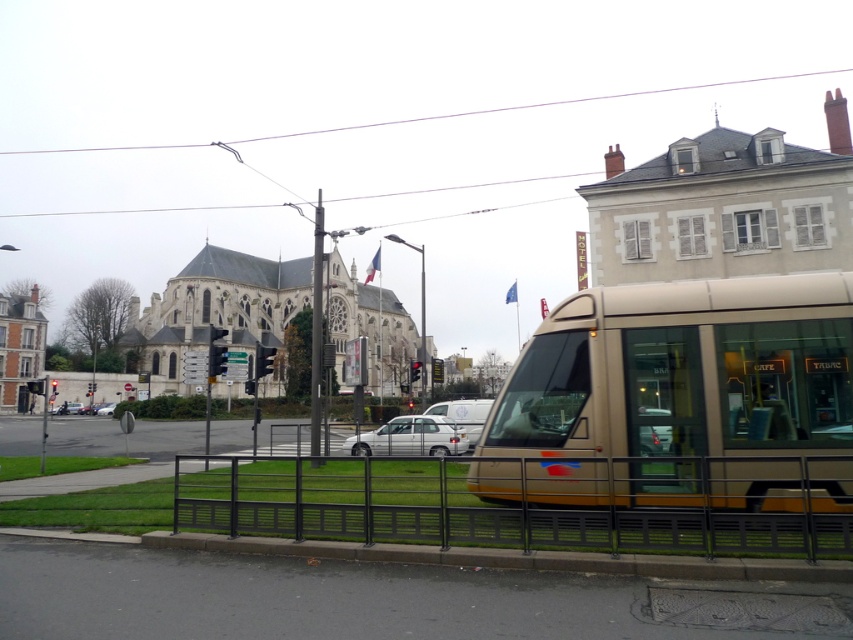
Question: Where is gold metallic tram at center located in relation to metallic gray fence at lower center in the image?

Choices:
 (A) left
 (B) right

Answer: (B)

Question: Can you confirm if white matte car at center is positioned below silver metallic sedan at center?

Choices:
 (A) no
 (B) yes

Answer: (A)

Question: Which of the following is the closest to the observer?

Choices:
 (A) (608, 304)
 (B) (405, 438)
 (C) (100, 413)
 (D) (225, 461)

Answer: (A)

Question: Can you confirm if metallic gray fence at lower center is wider than silver metallic sedan at center?

Choices:
 (A) no
 (B) yes

Answer: (B)

Question: Estimate the real-world distances between objects in this image. Which object is farther from the silver metallic sedan at center?

Choices:
 (A) white matte car at center
 (B) metallic gray fence at lower center
 (C) gold metallic tram at center

Answer: (C)

Question: Which object is farther from the camera taking this photo?

Choices:
 (A) gold metallic tram at center
 (B) metallic gray fence at lower center
 (C) white matte car at center

Answer: (C)